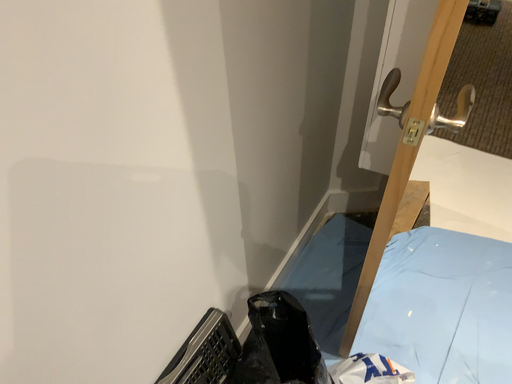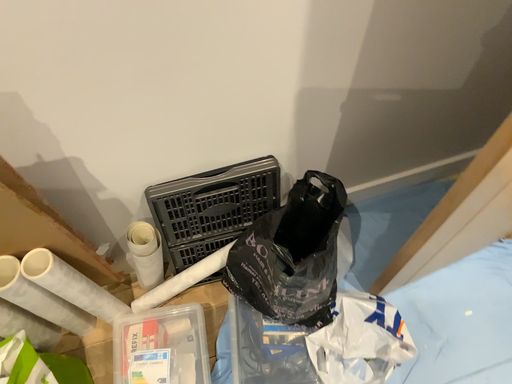
Question: Which way did the camera rotate in the video?

Choices:
 (A) rotated right
 (B) rotated left

Answer: (B)